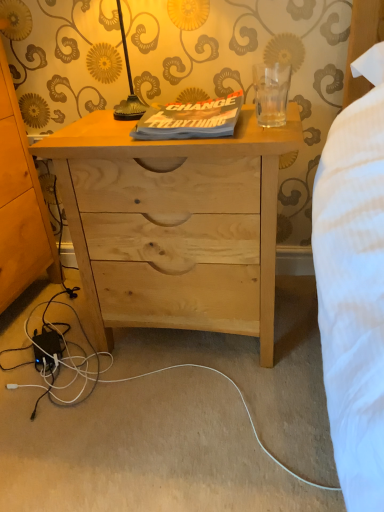
What do you see at coordinates (174, 225) in the screenshot? The width and height of the screenshot is (384, 512). I see `natural wood desk at center` at bounding box center [174, 225].

The width and height of the screenshot is (384, 512). Identify the location of natural wood desk at center. (174, 225).

Where is `natural wood desk at center`? natural wood desk at center is located at coordinates (174, 225).